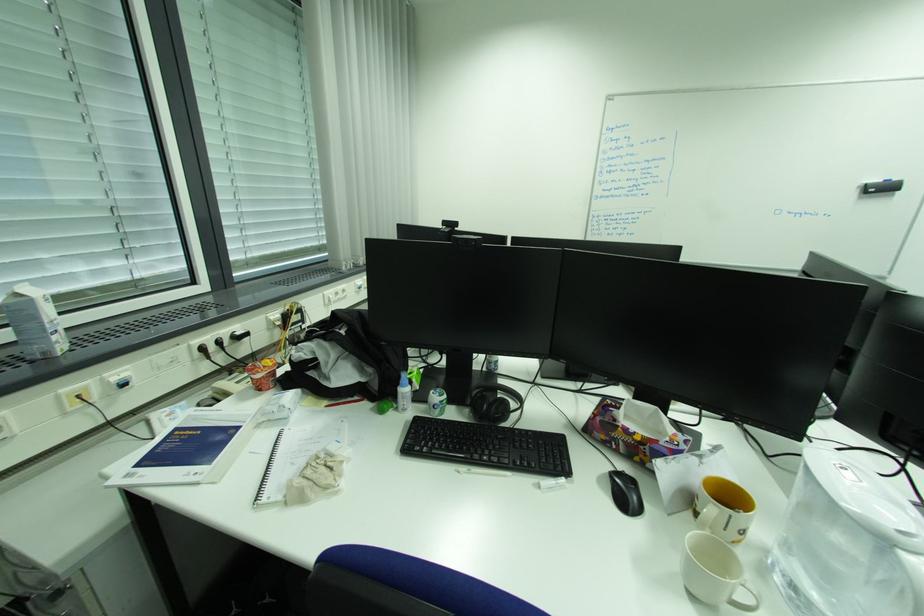
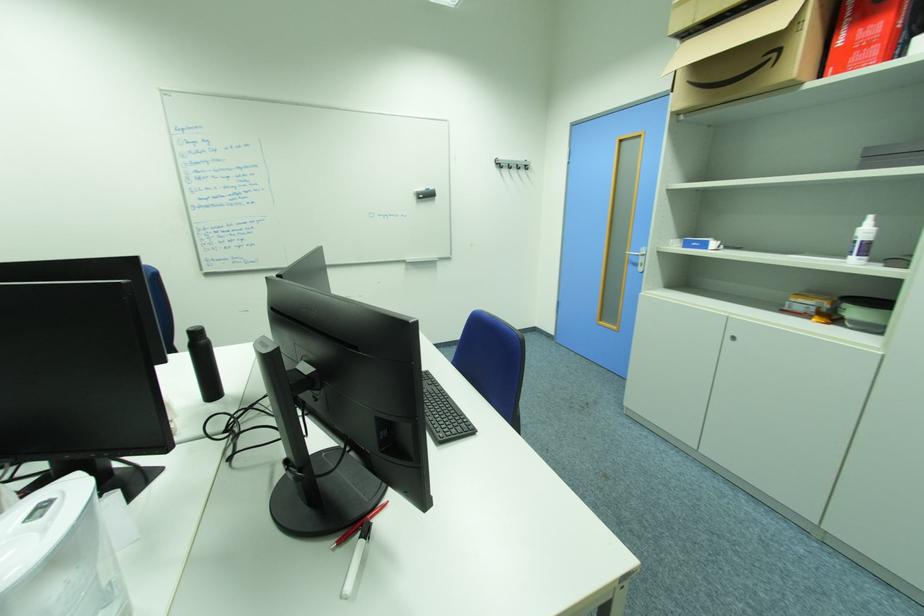
Question: The images are taken continuously from a first-person perspective. In which direction is your viewpoint rotating?

Choices:
 (A) Left
 (B) Right
 (C) Up
 (D) Down

Answer: (B)